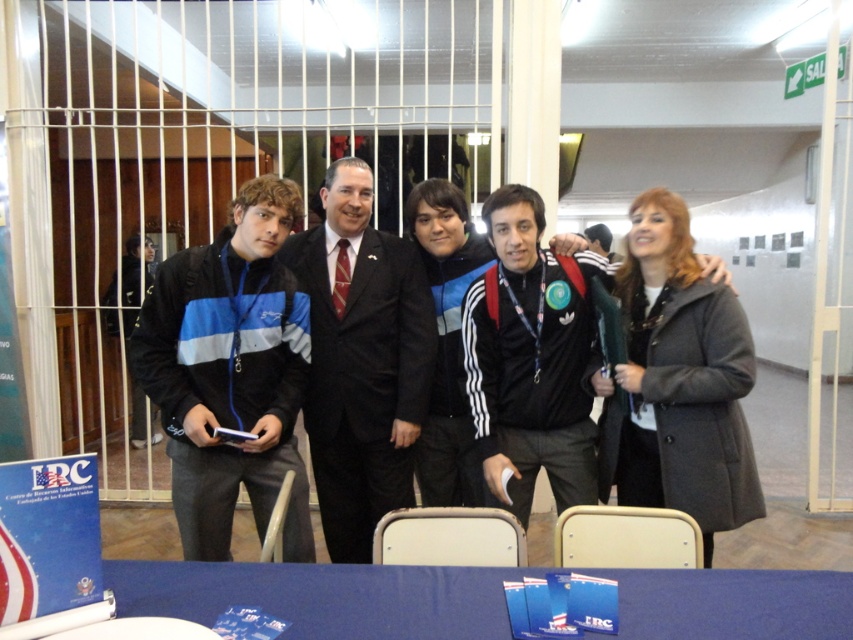
Question: Which point is closer to the camera?

Choices:
 (A) click(x=579, y=282)
 (B) click(x=349, y=388)
 (C) click(x=277, y=396)

Answer: (C)

Question: From the image, what is the correct spatial relationship of blue fabric table at lower center in relation to black adidas jacket at center?

Choices:
 (A) left
 (B) right

Answer: (A)

Question: Which of the following is the closest to the observer?

Choices:
 (A) (602, 381)
 (B) (708, 602)
 (C) (421, 392)
 (D) (602, 273)

Answer: (B)

Question: From the image, what is the correct spatial relationship of black fleece jacket at center in relation to black suit at center?

Choices:
 (A) above
 (B) below

Answer: (A)

Question: Considering the real-world distances, which object is closest to the black suit at center?

Choices:
 (A) black fleece jacket at center
 (B) black adidas jacket at center
 (C) blue fabric table at lower center
 (D) gray wool coat at right

Answer: (A)

Question: Does black suit at center have a greater width compared to gray wool coat at right?

Choices:
 (A) yes
 (B) no

Answer: (A)